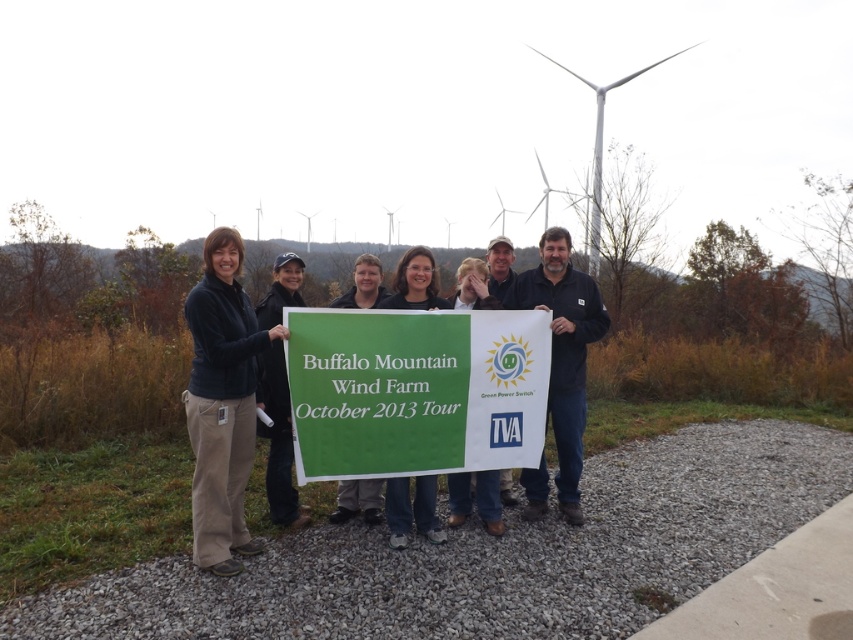
You are standing at the center of the gravel path leading to the group holding the banner. Looking towards the group, which object is located at the coordinates point (563, 349)?

The point (563, 349) corresponds to the black fabric shirt at center.

Based on the scene described, can you determine which object is taller between the black fabric shirt at center and the white composite wind turbine at upper center?

The white composite wind turbine at upper center is taller than the black fabric shirt at center.